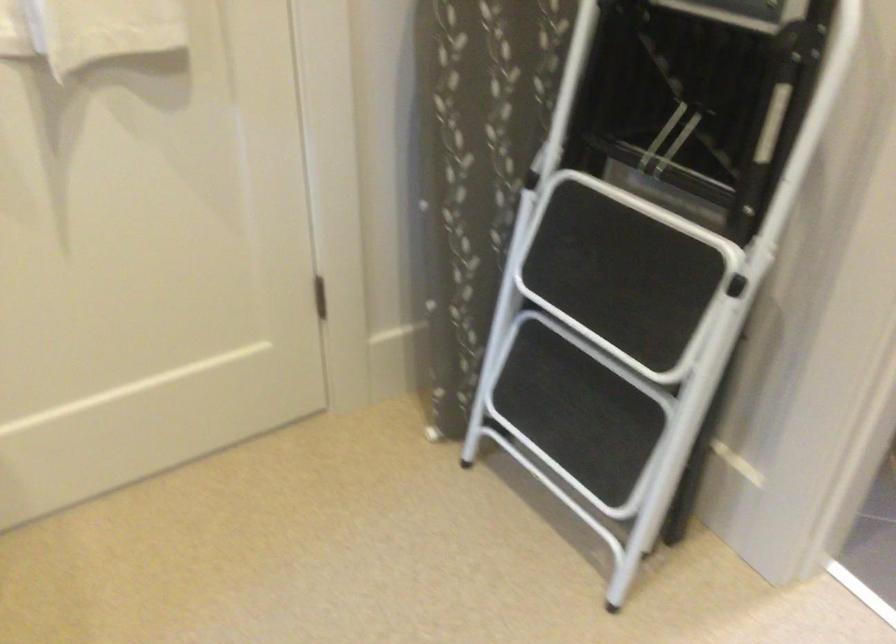
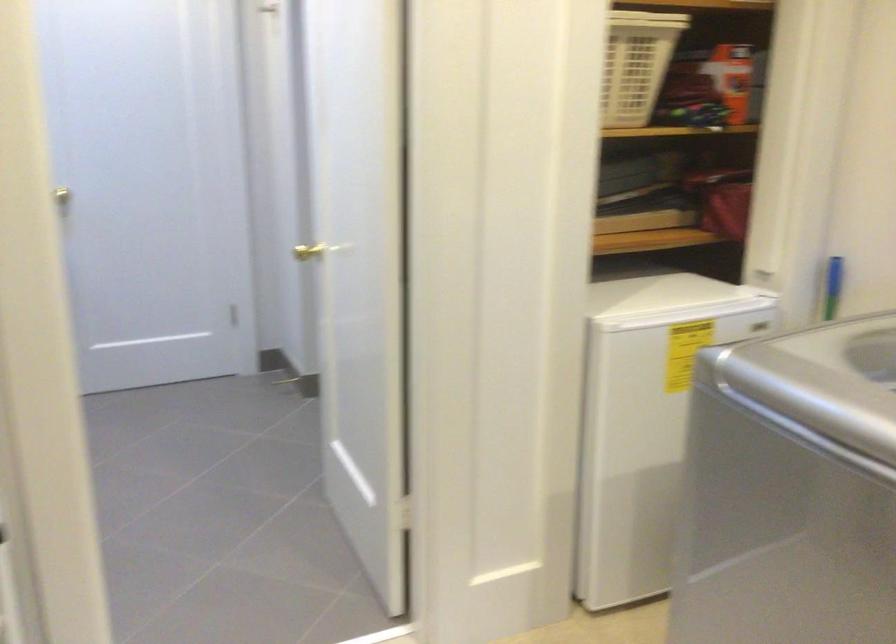
Question: How did the camera likely rotate?

Choices:
 (A) Left
 (B) Right
 (C) Up
 (D) Down

Answer: (B)